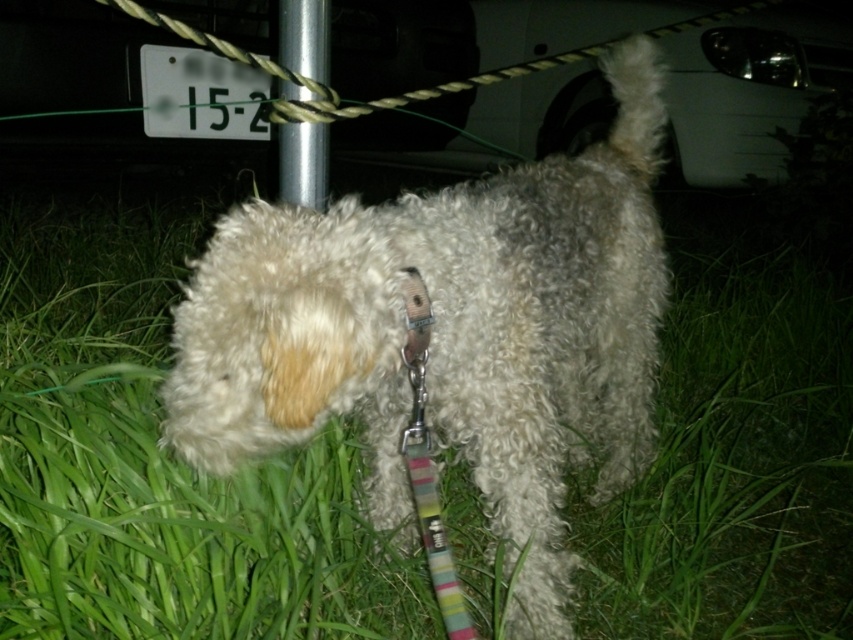
Question: Which of the following is the closest to the observer?

Choices:
 (A) (543, 225)
 (B) (317, 156)

Answer: (A)

Question: Does fuzzy white dog at center appear over silver metallic pole at center?

Choices:
 (A) no
 (B) yes

Answer: (A)

Question: Does fuzzy white dog at center appear on the right side of silver metallic pole at center?

Choices:
 (A) no
 (B) yes

Answer: (B)

Question: Which point is farther from the camera taking this photo?

Choices:
 (A) (318, 131)
 (B) (538, 266)

Answer: (A)

Question: Which of the following is the closest to the observer?

Choices:
 (A) fuzzy white dog at center
 (B) silver metallic pole at center

Answer: (A)

Question: Can you confirm if fuzzy white dog at center is wider than silver metallic pole at center?

Choices:
 (A) no
 (B) yes

Answer: (B)